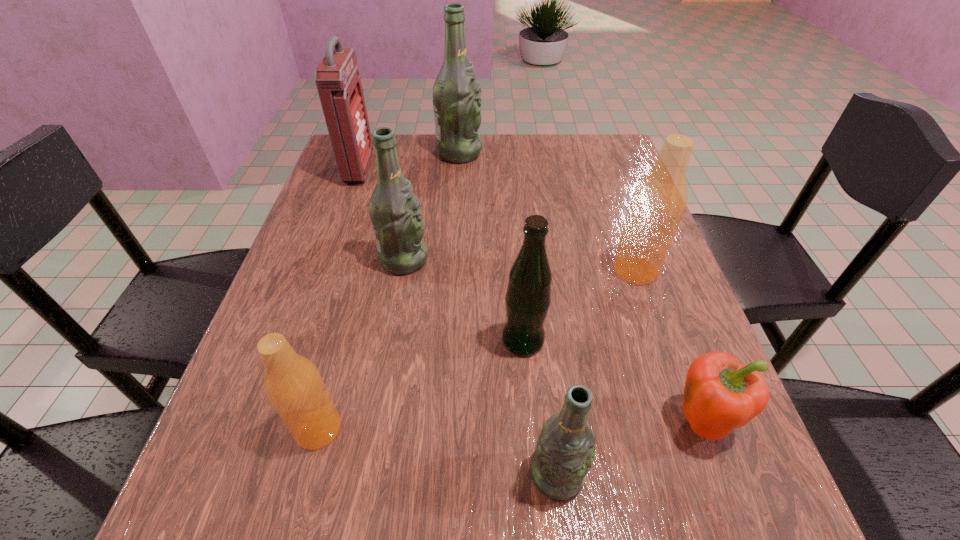
Image resolution: width=960 pixels, height=540 pixels. In order to click on free space located on the left of the shortest object in this screenshot , I will do `click(507, 421)`.

At what (x,y) coordinates should I click in order to perform the action: click on beer bottle that is at the far edge. Please return your answer as a coordinate pair (x, y). The image size is (960, 540). Looking at the image, I should click on (456, 93).

You are a GUI agent. You are given a task and a screenshot of the screen. Output one action in this format:
    pyautogui.click(x=<x>, y=<y>)
    Task: Click on the first-aid kit that is at the far edge
    
    Given the screenshot: What is the action you would take?
    pyautogui.click(x=338, y=81)

Where is `object present at the near edge`? object present at the near edge is located at coordinates (565, 449).

Locate an element on the screen. Image resolution: width=960 pixels, height=540 pixels. the first-aid kit that is at the left edge is located at coordinates (338, 81).

Locate an element on the screen. The height and width of the screenshot is (540, 960). beer bottle located at the left edge is located at coordinates tap(292, 383).

In order to click on beer bottle located at the right edge in this screenshot , I will do `click(658, 203)`.

Where is `pepper at the right edge`? pepper at the right edge is located at coordinates (720, 395).

Where is `object that is at the far left corner`? This screenshot has width=960, height=540. object that is at the far left corner is located at coordinates (338, 81).

Find the location of a particular element. free space at the far edge of the desktop is located at coordinates (546, 159).